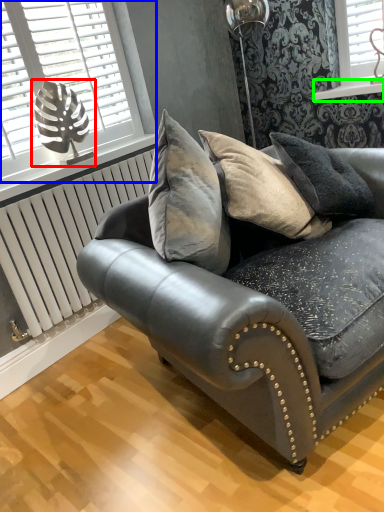
Question: Estimate the real-world distances between objects in this image. Which object is farther from table lamp (highlighted by a red box), window (highlighted by a blue box) or window sill (highlighted by a green box)?

Choices:
 (A) window
 (B) window sill

Answer: (B)